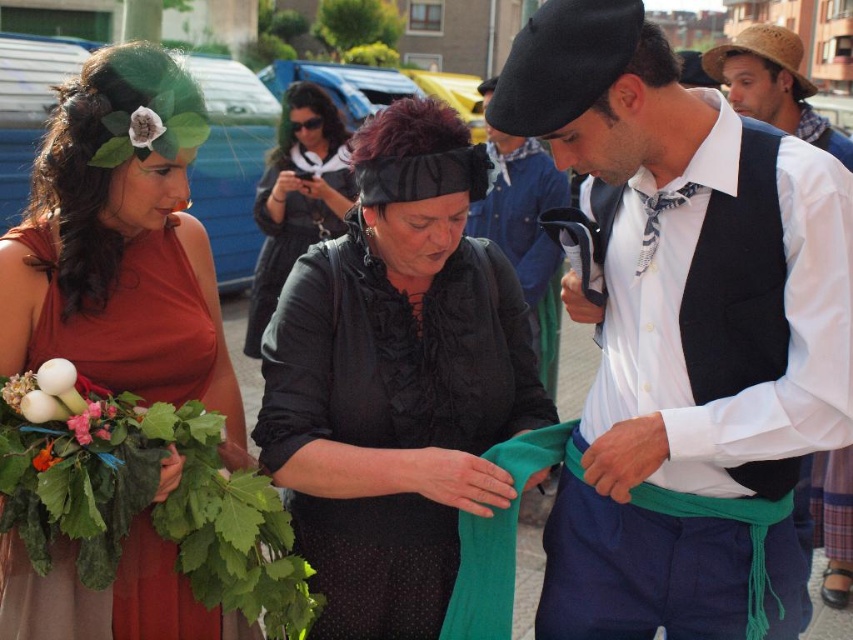
You are standing at the center of the scene and want to place a new decorative item at the exact location where the rustic straw hat at upper right is currently positioned. What coordinates should you use?

The coordinates for the rustic straw hat at upper right are point (773, 84).

You are standing in the festival area and want to find the straw hat at upper right. Based on the coordinates provided, in which direction should you look relative to your current position?

The straw hat at upper right is located at coordinates point [762,52], so you should look towards the upper right direction from your current position.

You are a photographer positioned in front of the scene. You want to take a photo that includes both the matte red dress at left and the green leafy bouquet at lower left. Which object should you adjust your camera focus to first to ensure both are in the frame?

The matte red dress at left is further to the viewer than the green leafy bouquet at lower left, so you should focus on the matte red dress at left first to ensure both are in the frame.